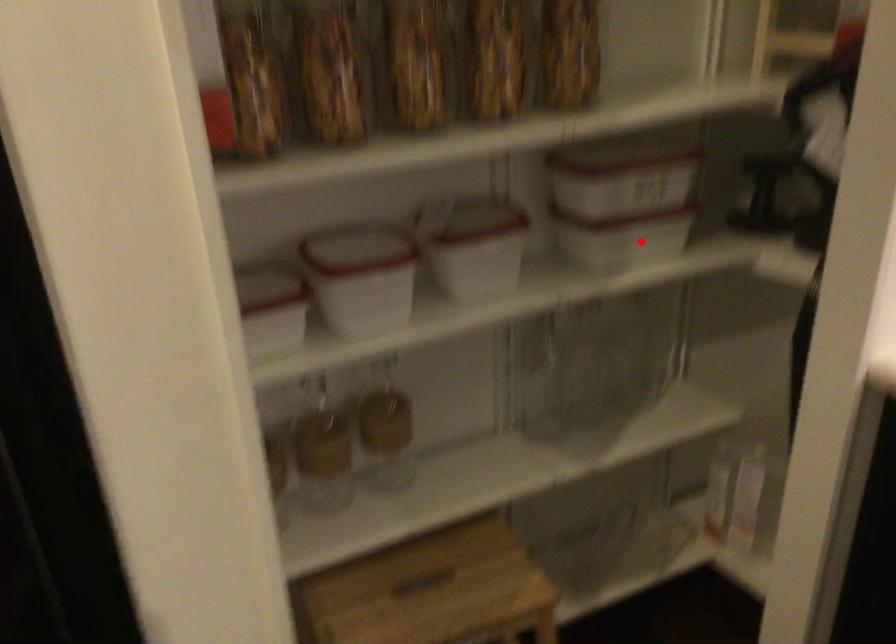
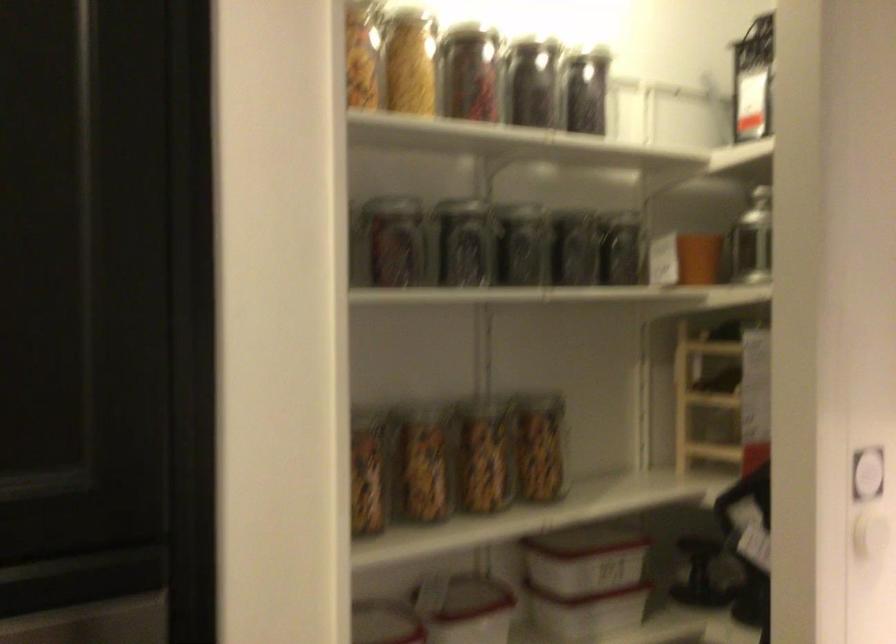
Question: I am providing you with two images of the same scene from different viewpoints. A red point is shown in image1. For the corresponding object point in image2, is it positioned nearer or farther from the camera?

Choices:
 (A) Nearer
 (B) Farther

Answer: (B)